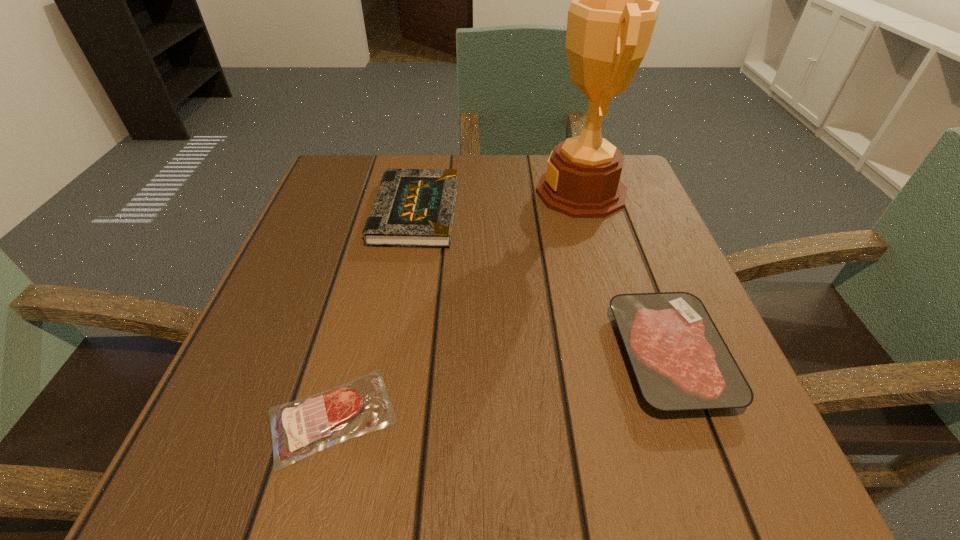
I want to click on vacant space situated 0.120m on the left of the right steak, so click(538, 356).

At what (x,y) coordinates should I click in order to perform the action: click on vacant space located 0.140m on the back of the shortest object. Please return your answer as a coordinate pair (x, y). This screenshot has height=540, width=960. Looking at the image, I should click on (363, 300).

Where is `award situated at the far edge`? The width and height of the screenshot is (960, 540). award situated at the far edge is located at coordinates (611, 19).

The width and height of the screenshot is (960, 540). I want to click on notebook that is positioned at the far edge, so click(414, 207).

In order to click on object that is at the near edge in this screenshot , I will do `click(300, 428)`.

What are the coordinates of `notebook that is positioned at the left edge` in the screenshot? It's located at (414, 207).

In order to click on steak that is at the left edge in this screenshot , I will do `click(300, 428)`.

The height and width of the screenshot is (540, 960). What are the coordinates of `award present at the right edge` in the screenshot? It's located at (611, 19).

At what (x,y) coordinates should I click in order to perform the action: click on steak that is at the right edge. Please return your answer as a coordinate pair (x, y). Image resolution: width=960 pixels, height=540 pixels. Looking at the image, I should click on (681, 362).

Locate an element on the screen. object that is at the far left corner is located at coordinates (414, 207).